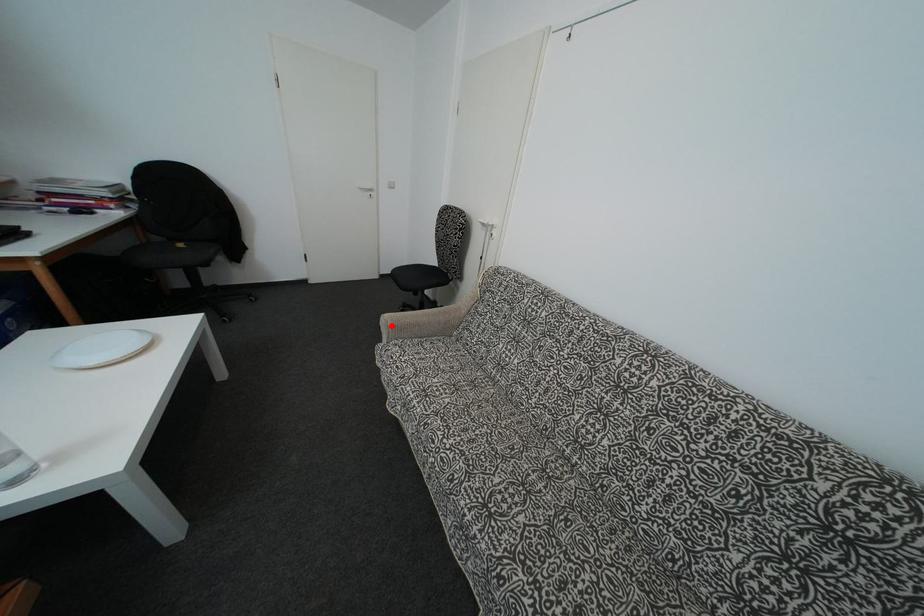
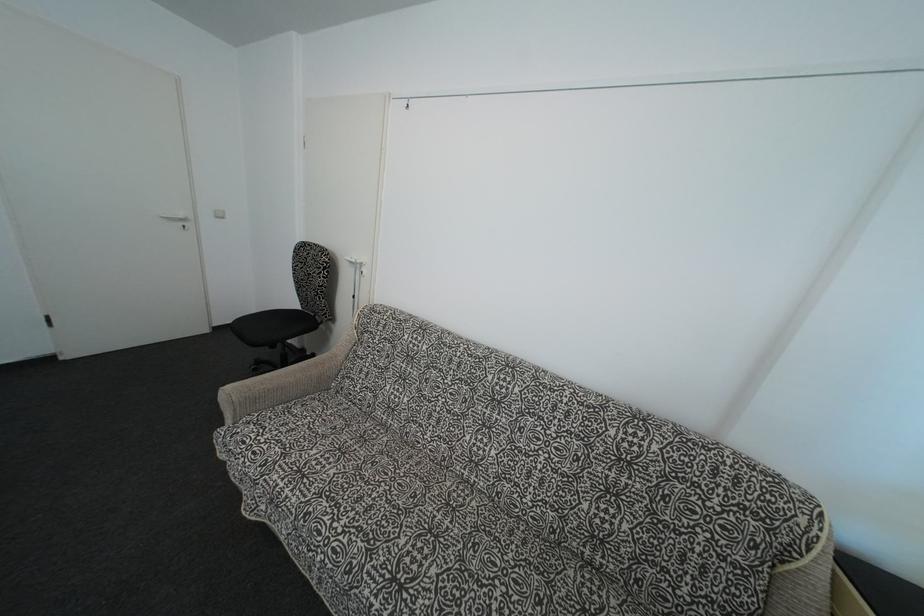
Question: I am providing you with two images of the same scene from different viewpoints. Given a red point in image1, look at the same physical point in image2. Is it:

Choices:
 (A) Closer to the viewpoint
 (B) Farther from the viewpoint

Answer: (B)